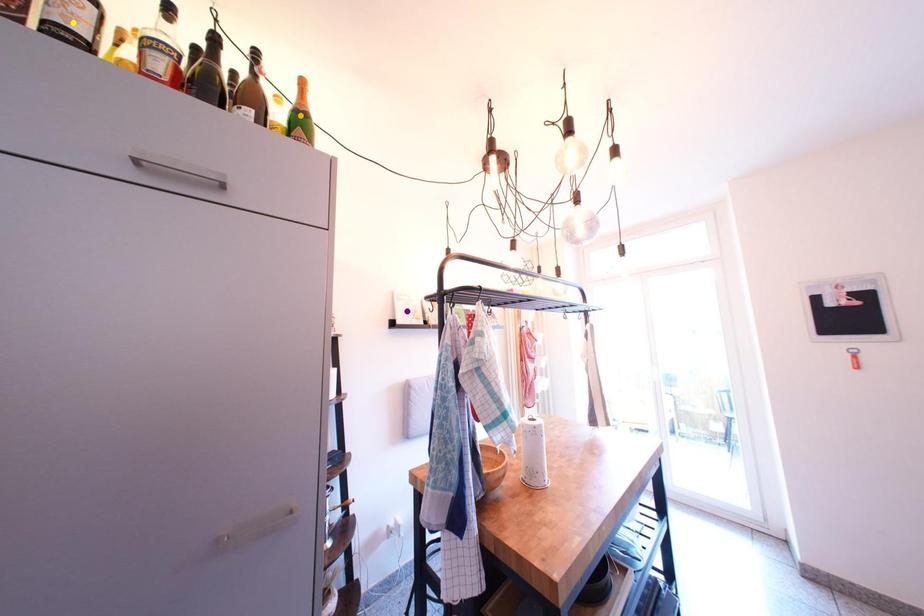
Order these from nearest to farthest:
A) yellow point
B) purple point
C) orange point

yellow point → orange point → purple point